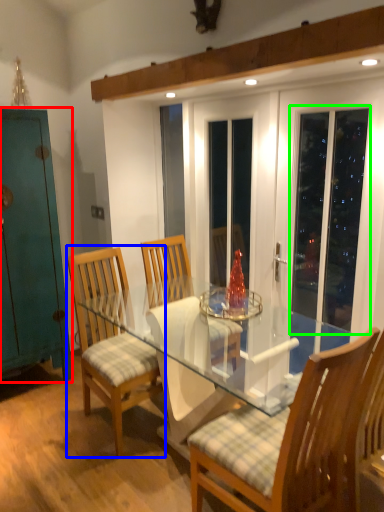
Question: Which object is the farthest from cabinetry (highlighted by a red box)? Choose among these: chair (highlighted by a blue box) or screen door (highlighted by a green box).

Choices:
 (A) chair
 (B) screen door

Answer: (B)